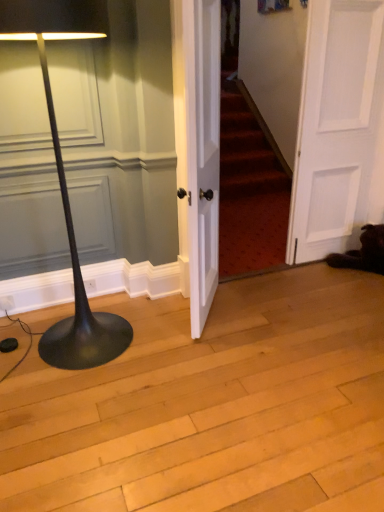
Question: Choose the correct answer: Is white wood door at center, the second door when ordered from right to left, inside white matte door at right, which is counted as the 2th door, starting from the left, or outside it?

Choices:
 (A) outside
 (B) inside

Answer: (A)

Question: From a real-world perspective, is white wood door at center, the first door positioned from the left, positioned above or below white matte door at right, which is counted as the 2th door, starting from the left?

Choices:
 (A) below
 (B) above

Answer: (A)

Question: Which of these objects is positioned farthest from the white wood door at center, the second door when ordered from right to left?

Choices:
 (A) white matte door at right, acting as the 1th door starting from the right
 (B) black matte floor lamp at left

Answer: (A)

Question: Estimate the real-world distances between objects in this image. Which object is closer to the black matte floor lamp at left?

Choices:
 (A) white wood door at center, the second door when ordered from right to left
 (B) white matte door at right, acting as the 1th door starting from the right

Answer: (A)